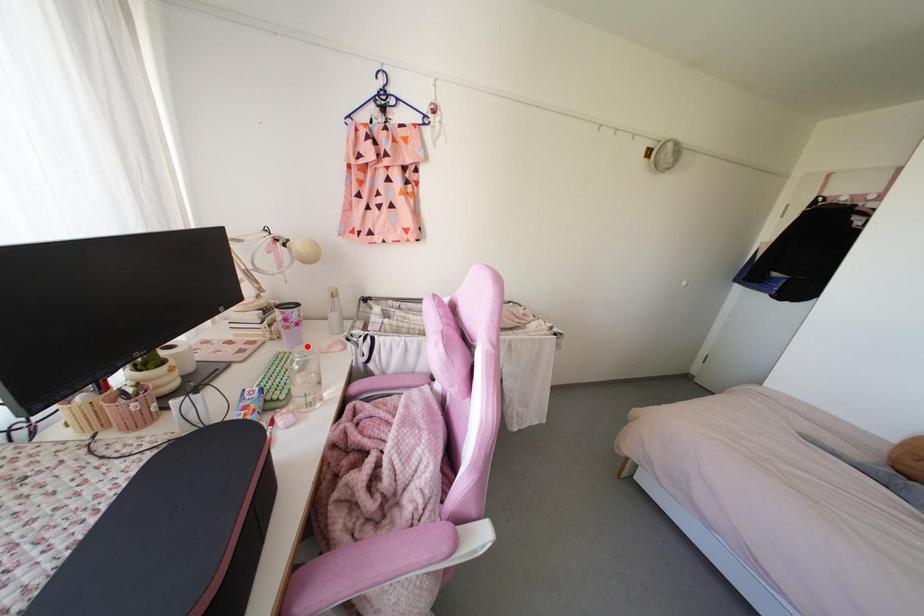
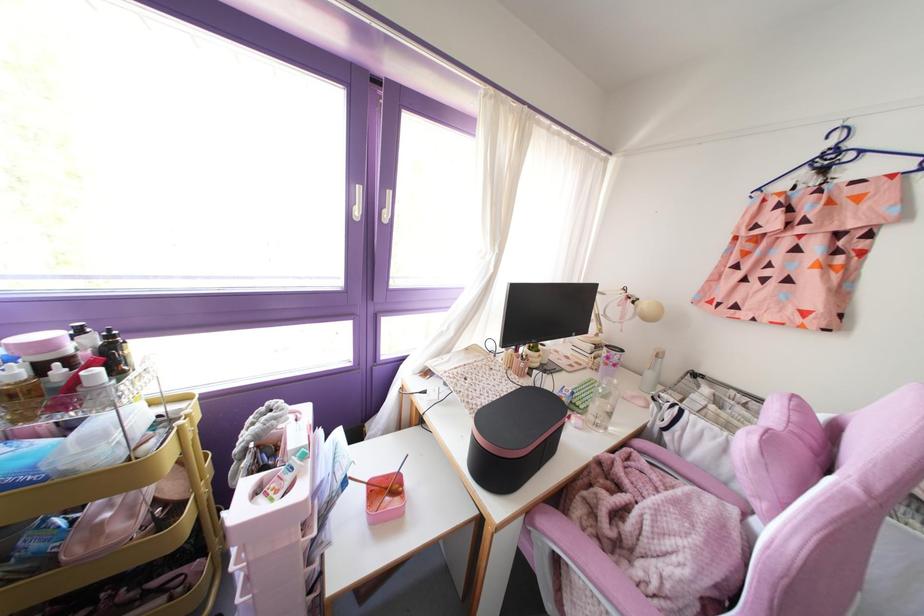
Locate, in the second image, the point that corresponds to the highlighted location in the first image.

(614, 381)